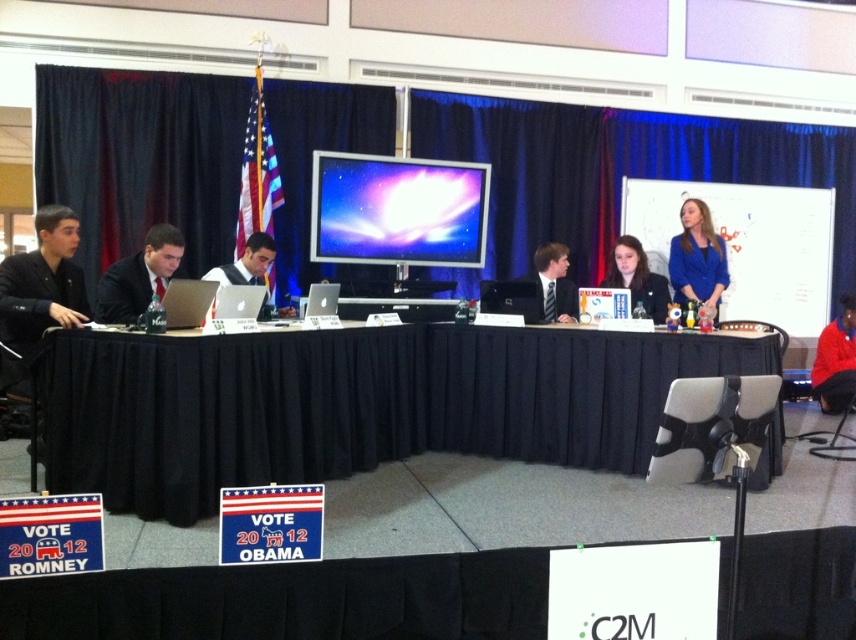
You are a photographer at the event and want to take a photo of the blue fabric jacket at upper right and the matte silver laptop at center. Which object will appear smaller in the photo?

The blue fabric jacket at upper right is smaller than the matte silver laptop at center, so it will appear smaller in the photo.

You are an event organizer and need to decide where to place a new projector. The projector requires a surface that is taller than the other. Which object should you choose between the whiteboard at upper right and the matte plastic screen at center?

The whiteboard at upper right has a greater height compared to the matte plastic screen at center, so you should choose the whiteboard at upper right as the surface for the projector since it is taller.

You are a participant in the debate and need to write on the whiteboard at upper right. Where exactly is the whiteboard located in the room?

The whiteboard at upper right is located at point (750, 244) in the room.